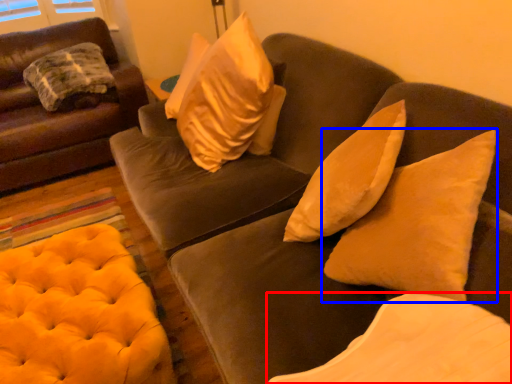
Question: Which object appears farthest to the camera in this image, pillow (highlighted by a red box) or pillow (highlighted by a blue box)?

Choices:
 (A) pillow
 (B) pillow

Answer: (B)